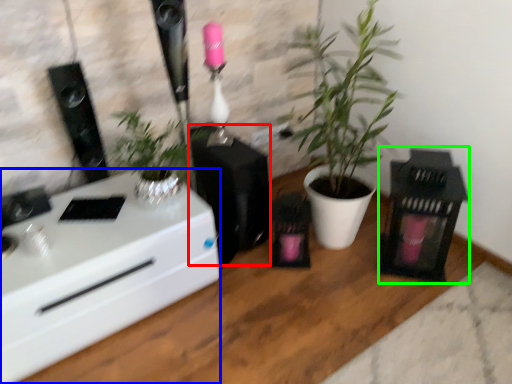
Question: Based on their relative distances, which object is nearer to appliance (highlighted by a red box)? Choose from desk (highlighted by a blue box) and appliance (highlighted by a green box).

Choices:
 (A) desk
 (B) appliance

Answer: (A)